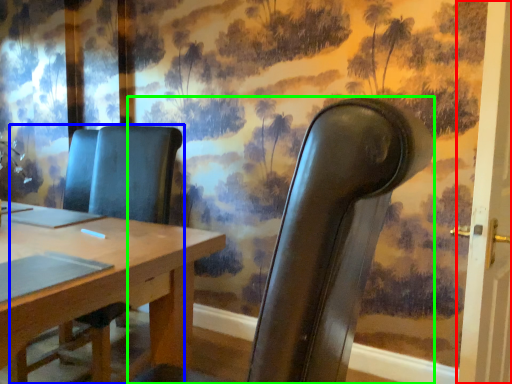
Question: Which object is the farthest from door (highlighted by a red box)? Choose among these: chair (highlighted by a blue box) or chair (highlighted by a green box).

Choices:
 (A) chair
 (B) chair

Answer: (A)